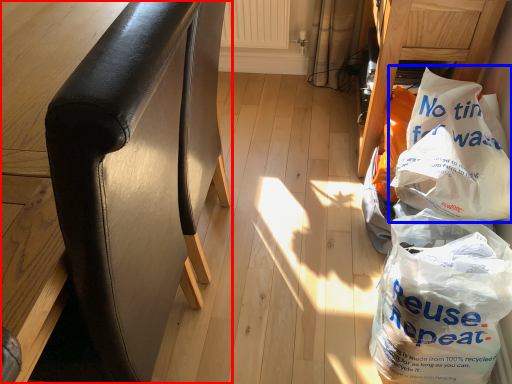
Question: Among these objects, which one is nearest to the camera, furniture (highlighted by a red box) or plastic bag (highlighted by a blue box)?

Choices:
 (A) furniture
 (B) plastic bag

Answer: (A)